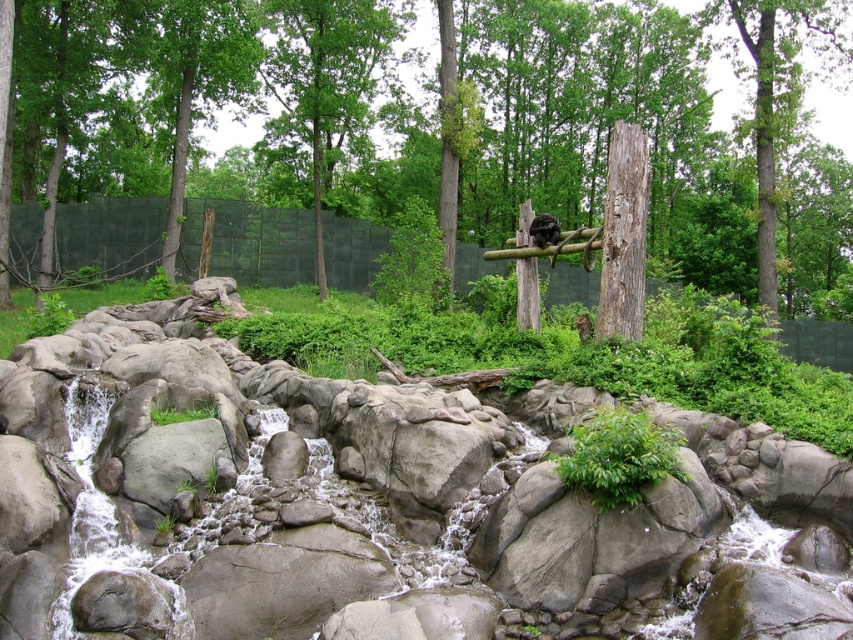
You are a zookeeper observing the zoo enclosure. You need to determine if the black fur monkey at center can reach the top of the brown rough tree trunk at upper center. Can it? Please explain based on their heights.

The brown rough tree trunk at upper center is taller than the black fur monkey at center. Since the tree trunk is taller, the monkey cannot reach its top.

You are a zookeeper planning to place a small animal enclosure between the smooth gray rock at center and the green leafy tree at center. Considering their sizes, which object will require more space around it for safety?

The smooth gray rock at center has a larger size compared to the green leafy tree at center, so it will require more space around it for safety.

You are a zookeeper observing the zoo enclosure. You notice the green leafy tree at center and the brown rough tree trunk at upper center. Which of these two trees is positioned higher in the image?

The green leafy tree at center is located above the brown rough tree trunk at upper center, so it is positioned higher in the image.